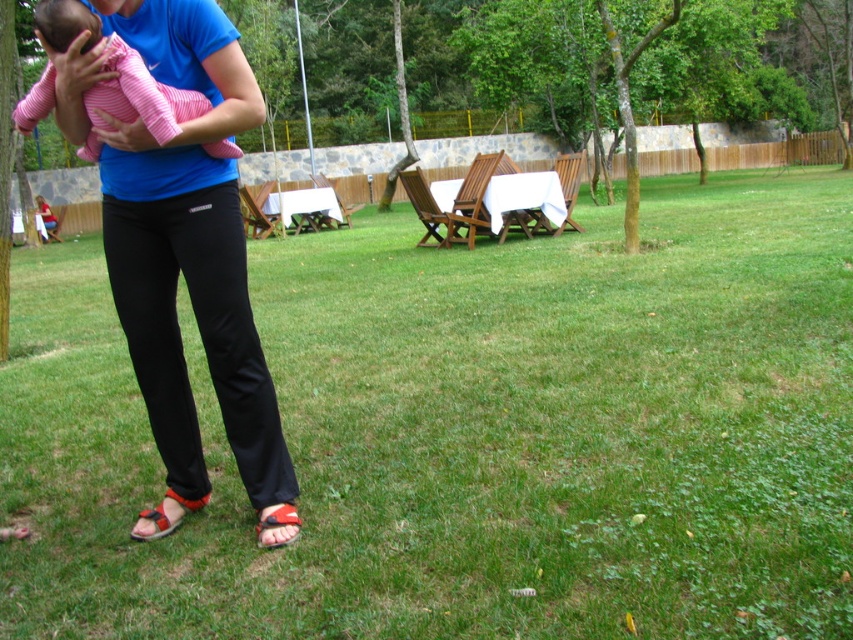
Does green grass at center lie behind matte black pants at center?

No, it is in front of matte black pants at center.

Who is lower down, green grass at center or matte black pants at center?

Positioned lower is matte black pants at center.

This screenshot has height=640, width=853. What are the coordinates of `green grass at center` in the screenshot? It's located at point(469,433).

Find the location of a particular element. green grass at center is located at coordinates (469, 433).

Does matte black pants at center have a smaller size compared to pink striped fabric baby at center?

Incorrect, matte black pants at center is not smaller in size than pink striped fabric baby at center.

Can you confirm if matte black pants at center is positioned to the left of pink striped fabric baby at center?

In fact, matte black pants at center is to the right of pink striped fabric baby at center.

At what (x,y) coordinates should I click in order to perform the action: click on matte black pants at center. Please return your answer as a coordinate pair (x, y). The width and height of the screenshot is (853, 640). Looking at the image, I should click on (189, 250).

Where is `matte black pants at center`? The image size is (853, 640). matte black pants at center is located at coordinates (189, 250).

Who is higher up, matte black pants at center or red leather sandal at lower left?

matte black pants at center is above.

Who is shorter, matte black pants at center or red leather sandal at lower left?

With less height is red leather sandal at lower left.

Locate an element on the screen. Image resolution: width=853 pixels, height=640 pixels. matte black pants at center is located at coordinates point(189,250).